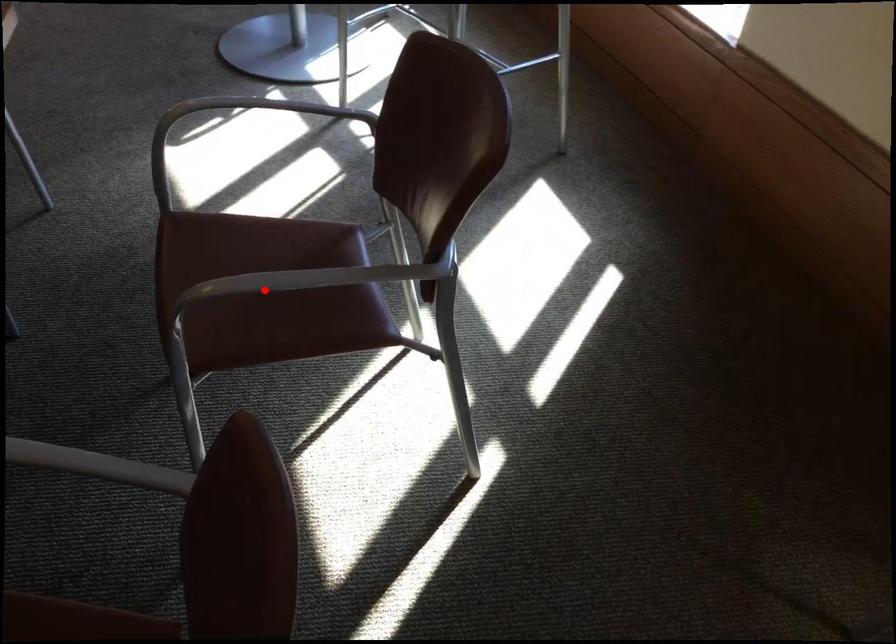
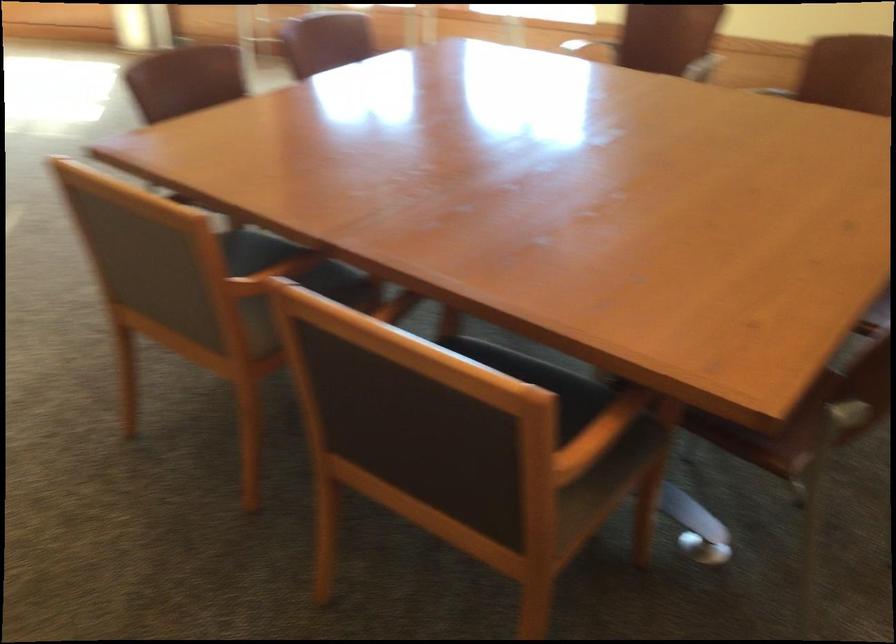
Question: I am providing you with two images of the same scene from different viewpoints. A red point is marked on the first image. At the location where the point appears in image 1, is it still visible in image 2?

Choices:
 (A) Yes
 (B) No

Answer: (B)